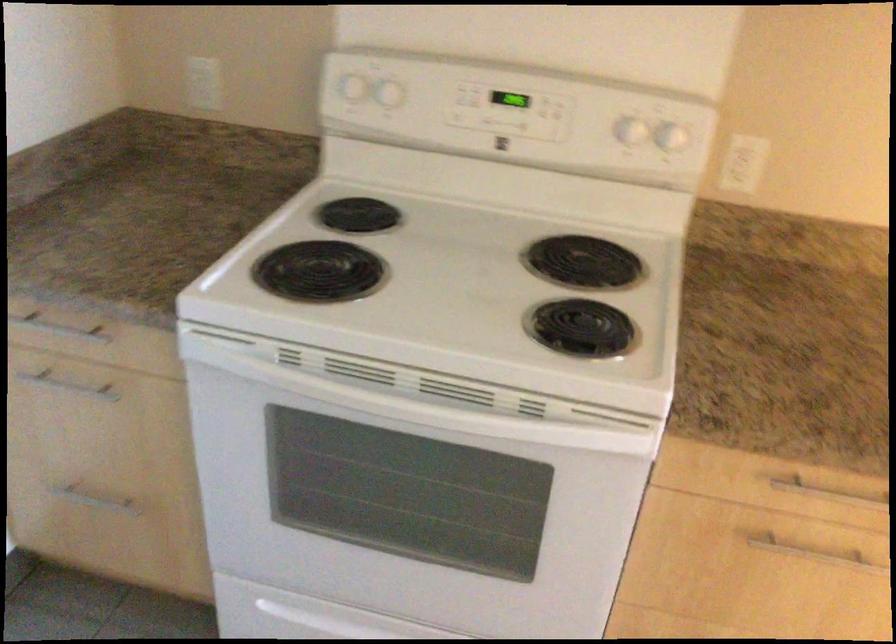
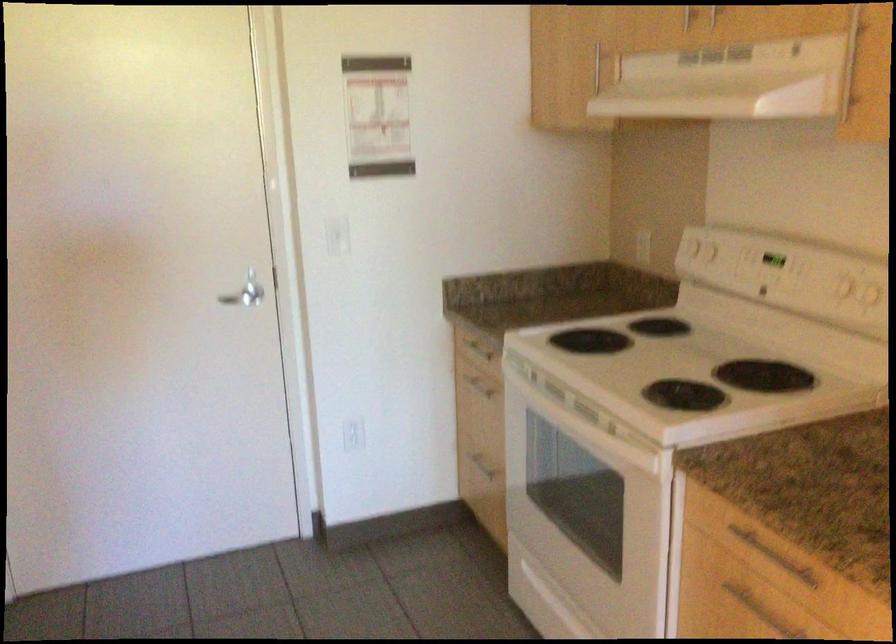
Where in the second image is the point corresponding to the point at 500,276 from the first image?

(686, 365)